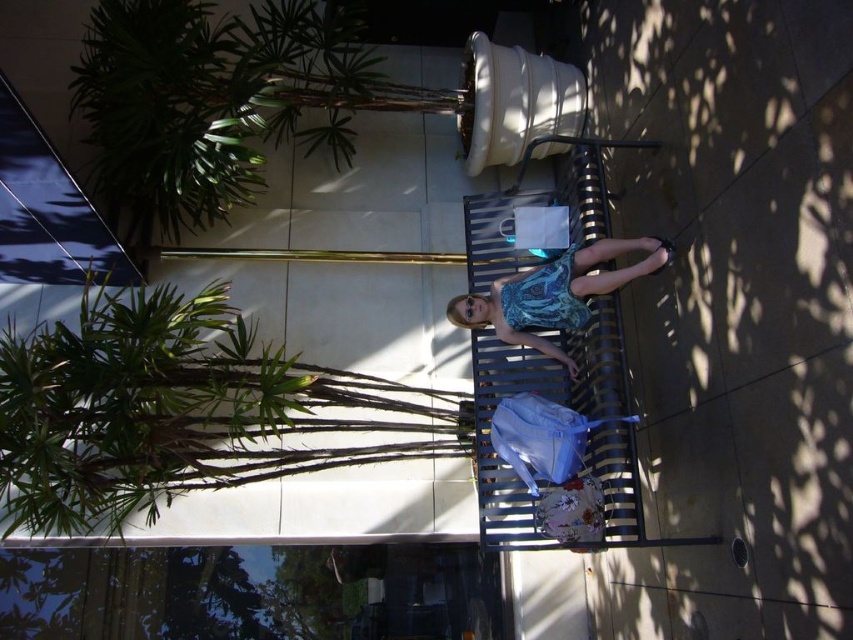
Between printed fabric dress at center and blue patterned fabric dress at center, which one is positioned lower?

printed fabric dress at center

Is printed fabric dress at center above blue patterned fabric dress at center?

Actually, printed fabric dress at center is below blue patterned fabric dress at center.

Identify the location of printed fabric dress at center. Image resolution: width=853 pixels, height=640 pixels. (555, 292).